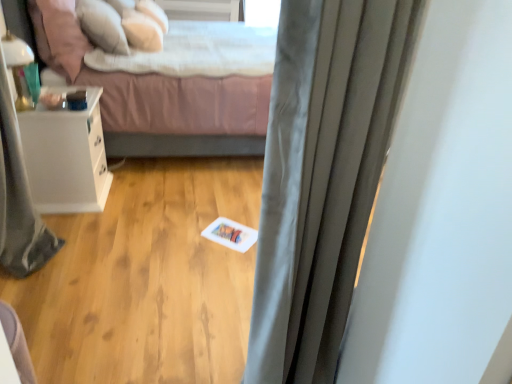
Question: Does white soft pillow at upper left, the second pillow positioned from the back, have a smaller size compared to gray fabric shower curtain at left?

Choices:
 (A) yes
 (B) no

Answer: (B)

Question: Does white soft pillow at upper left, the second pillow in the front-to-back sequence, appear on the right side of gray fabric shower curtain at left?

Choices:
 (A) yes
 (B) no

Answer: (A)

Question: Would you say gray fabric shower curtain at left is part of white soft pillow at upper left, the second pillow positioned from the back,'s contents?

Choices:
 (A) no
 (B) yes

Answer: (A)

Question: Is gray fabric shower curtain at left at the back of white soft pillow at upper left, the second pillow positioned from the back?

Choices:
 (A) yes
 (B) no

Answer: (B)

Question: Does white soft pillow at upper left, the second pillow positioned from the back, have a greater width compared to gray fabric shower curtain at left?

Choices:
 (A) no
 (B) yes

Answer: (B)

Question: Is satin gray curtain at center taller or shorter than soft pink pillow at upper left, the 3th pillow when ordered from back to front?

Choices:
 (A) tall
 (B) short

Answer: (A)

Question: From a real-world perspective, is satin gray curtain at center above or below soft pink pillow at upper left, the 3th pillow when ordered from back to front?

Choices:
 (A) above
 (B) below

Answer: (B)

Question: In terms of size, does satin gray curtain at center appear bigger or smaller than soft pink pillow at upper left, the 3th pillow when ordered from back to front?

Choices:
 (A) big
 (B) small

Answer: (A)

Question: From the image's perspective, is satin gray curtain at center located above or below soft pink pillow at upper left, acting as the 1th pillow starting from the front?

Choices:
 (A) below
 (B) above

Answer: (A)

Question: Looking at their shapes, would you say soft white pillow at upper center, arranged as the 3th pillow when viewed from the front, is wider or thinner than white matte card at center?

Choices:
 (A) thin
 (B) wide

Answer: (A)

Question: Would you say soft white pillow at upper center, marked as the 1th pillow in a back-to-front arrangement, is to the left or to the right of white matte card at center in the picture?

Choices:
 (A) right
 (B) left

Answer: (B)

Question: From a real-world perspective, relative to white matte card at center, is soft white pillow at upper center, marked as the 1th pillow in a back-to-front arrangement, vertically above or below?

Choices:
 (A) below
 (B) above

Answer: (B)

Question: Is soft white pillow at upper center, marked as the 1th pillow in a back-to-front arrangement, inside the boundaries of white matte card at center, or outside?

Choices:
 (A) inside
 (B) outside

Answer: (B)

Question: Based on their sizes in the image, would you say white glossy nightstand at left is bigger or smaller than white matte card at center?

Choices:
 (A) big
 (B) small

Answer: (A)

Question: From their relative heights in the image, would you say white glossy nightstand at left is taller or shorter than white matte card at center?

Choices:
 (A) tall
 (B) short

Answer: (A)